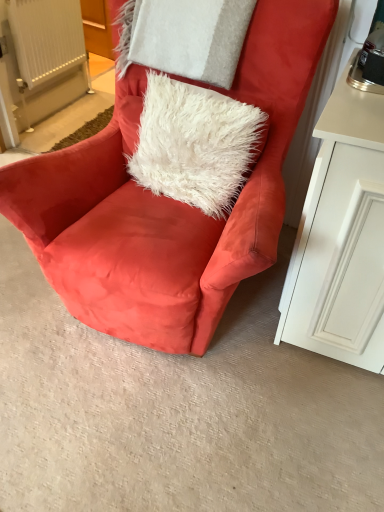
Question: Can you confirm if white fluffy pillow at upper center is positioned to the right of suede orange chair at center?

Choices:
 (A) no
 (B) yes

Answer: (B)

Question: From the image's perspective, does white fluffy pillow at upper center appear lower than suede orange chair at center?

Choices:
 (A) no
 (B) yes

Answer: (A)

Question: Is white fluffy pillow at upper center oriented towards suede orange chair at center?

Choices:
 (A) no
 (B) yes

Answer: (B)

Question: Is white fluffy pillow at upper center next to suede orange chair at center?

Choices:
 (A) yes
 (B) no

Answer: (B)

Question: Is white fluffy pillow at upper center facing away from suede orange chair at center?

Choices:
 (A) no
 (B) yes

Answer: (B)

Question: Is white fluffy pillow at upper center surrounding suede orange chair at center?

Choices:
 (A) no
 (B) yes

Answer: (A)

Question: From a real-world perspective, is white fluffy pillow at upper center physically above white fluffy pillow at upper center?

Choices:
 (A) no
 (B) yes

Answer: (A)

Question: Is white fluffy pillow at upper center at the right side of white fluffy pillow at upper center?

Choices:
 (A) no
 (B) yes

Answer: (B)

Question: From the image's perspective, is white fluffy pillow at upper center beneath white fluffy pillow at upper center?

Choices:
 (A) no
 (B) yes

Answer: (B)

Question: Considering the relative sizes of white fluffy pillow at upper center and white fluffy pillow at upper center in the image provided, is white fluffy pillow at upper center wider than white fluffy pillow at upper center?

Choices:
 (A) yes
 (B) no

Answer: (A)

Question: Is white fluffy pillow at upper center located outside white fluffy pillow at upper center?

Choices:
 (A) no
 (B) yes

Answer: (B)

Question: From a real-world perspective, is white fluffy pillow at upper center beneath white fluffy pillow at upper center?

Choices:
 (A) yes
 (B) no

Answer: (A)

Question: From a real-world perspective, does white plastic radiator at upper left sit lower than white fluffy pillow at upper center?

Choices:
 (A) no
 (B) yes

Answer: (B)